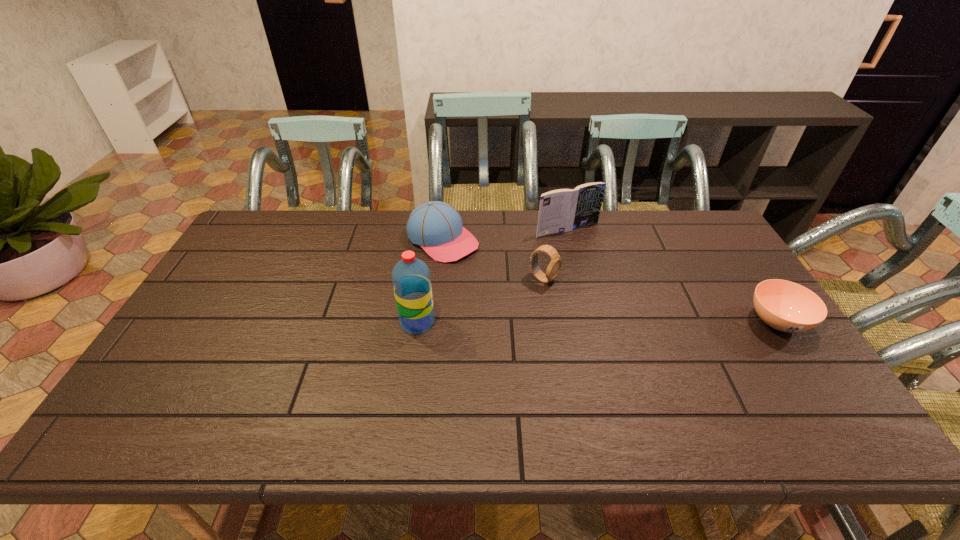
This screenshot has width=960, height=540. Find the location of `free spot between the book and the soup bowl`. free spot between the book and the soup bowl is located at coordinates (672, 276).

Identify the location of free space between the tallest object and the shortest object. (597, 322).

Where is `free space between the soup bowl and the baseball cap`? This screenshot has height=540, width=960. free space between the soup bowl and the baseball cap is located at coordinates (610, 281).

The height and width of the screenshot is (540, 960). I want to click on blank region between the watch and the soup bowl, so click(x=660, y=301).

Choose which object is the second nearest neighbor to the baseball cap. Please provide its 2D coordinates. Your answer should be formatted as a tuple, i.e. [(x, y)], where the tuple contains the x and y coordinates of a point satisfying the conditions above.

[(562, 210)]

Identify which object is the fourth nearest to the rightmost object. Please provide its 2D coordinates. Your answer should be formatted as a tuple, i.e. [(x, y)], where the tuple contains the x and y coordinates of a point satisfying the conditions above.

[(411, 279)]

Where is `free location that satisfies the following two spatial constraints: 1. on the front side of the shortest object; 2. on the left side of the watch`? The height and width of the screenshot is (540, 960). free location that satisfies the following two spatial constraints: 1. on the front side of the shortest object; 2. on the left side of the watch is located at coordinates (551, 322).

Image resolution: width=960 pixels, height=540 pixels. Identify the location of free region that satisfies the following two spatial constraints: 1. on the front side of the baseball cap; 2. on the right side of the soup bowl. (435, 322).